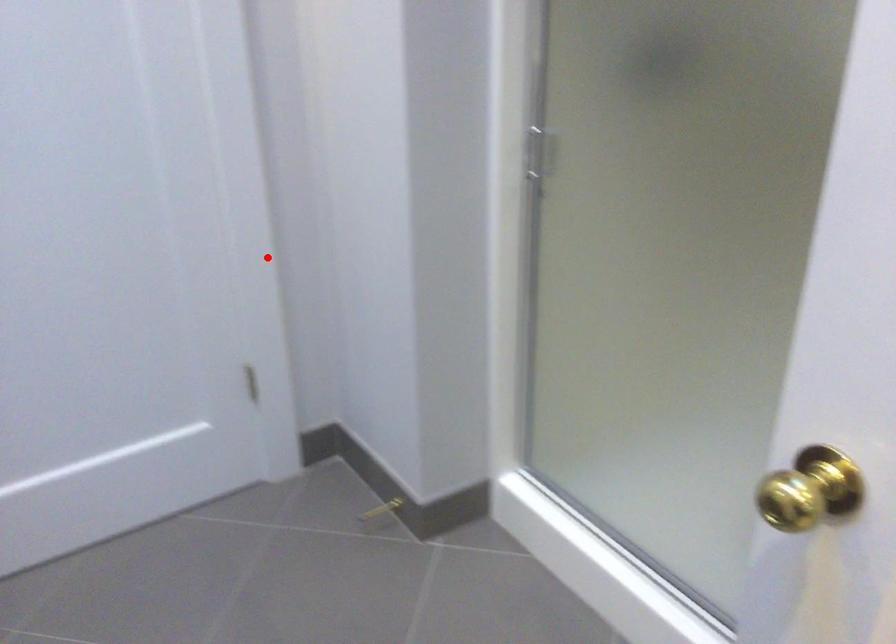
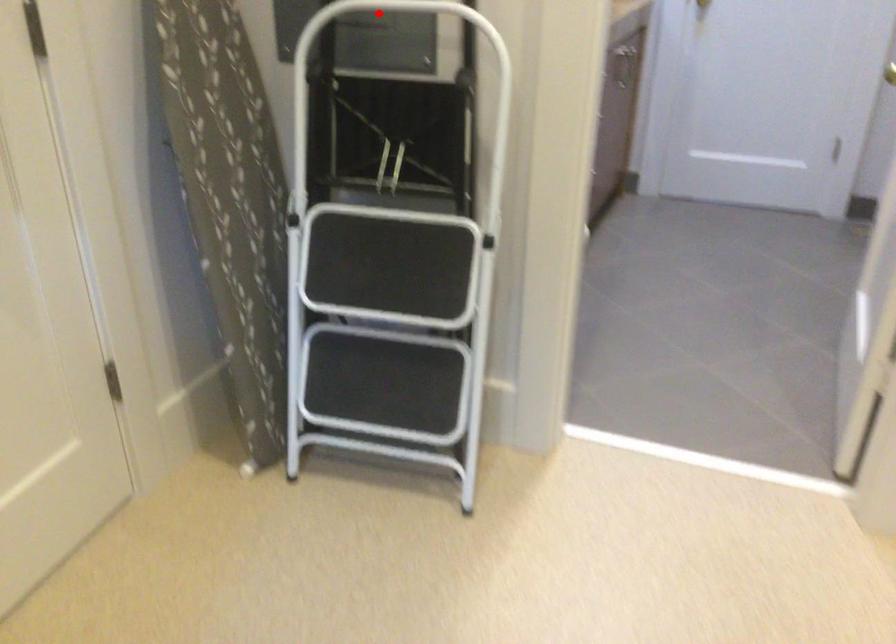
I am providing you with two images of the same scene from different viewpoints. A red point is marked on the first image and another point is marked on the second image. Is the red point in image1 aligned with the point shown in image2?

No